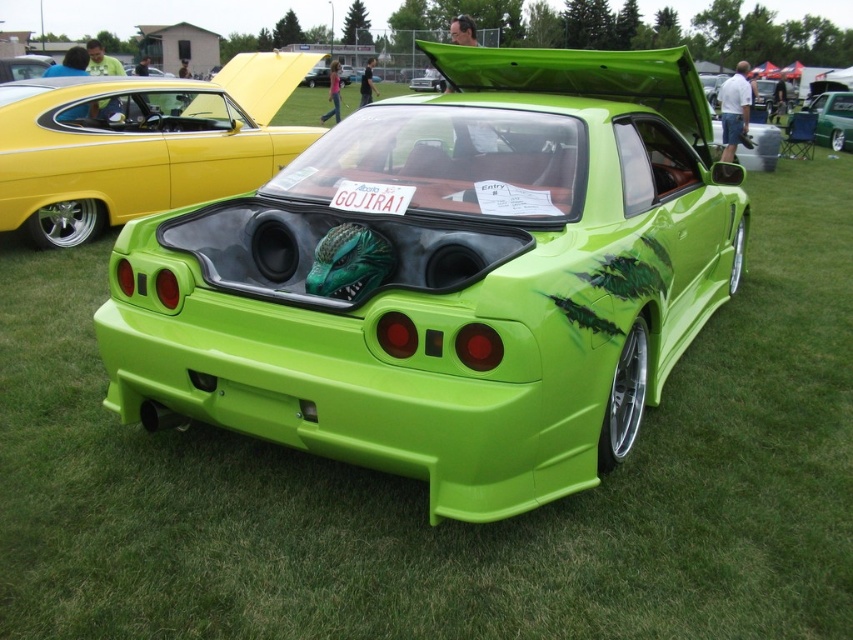
You are standing at the origin point in a coordinate system where the car show is taking place. The origin is at the bottom left corner of the image. The x and y axes increase to the right and upwards respectively. You want to walk directly to the green matte sports car at center. In which direction should you move first?

Since the green matte sports car at center is located at point (140, 145), which is to the right and slightly upwards from the origin, you should move first to the right direction.

You are standing at the car show and want to take a photo of the car. The point where you are standing is exactly at the coordinates point (132, 205). If you need to be at least 25 feet away to capture the entire car in one shot, will you be able to do so?

The distance between point (132, 205) and the viewer is 24.96 feet, which is just slightly less than the required 25 feet. Therefore, you might not be able to capture the entire car in one shot from that position.

You are a photographer at the car show and need to capture the green matte sports car at center and the green matte license plate at center in a single shot. Since the license plate is smaller, will you need to adjust your camera angle to ensure both are clearly visible?

The green matte sports car at center is larger in size than the green matte license plate at center, so you can capture both in a single shot without needing to adjust the camera angle for size differences. However, ensure the license plate is in focus.